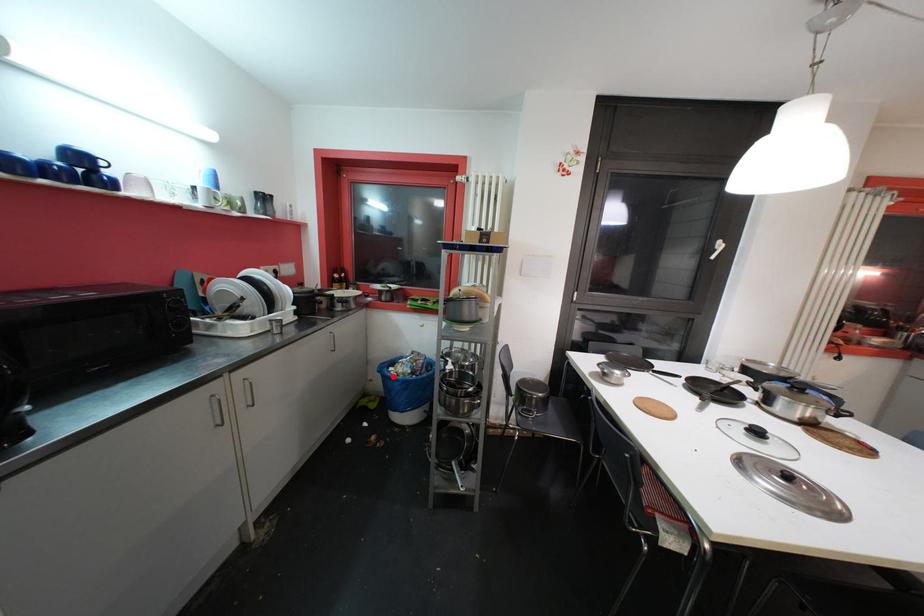
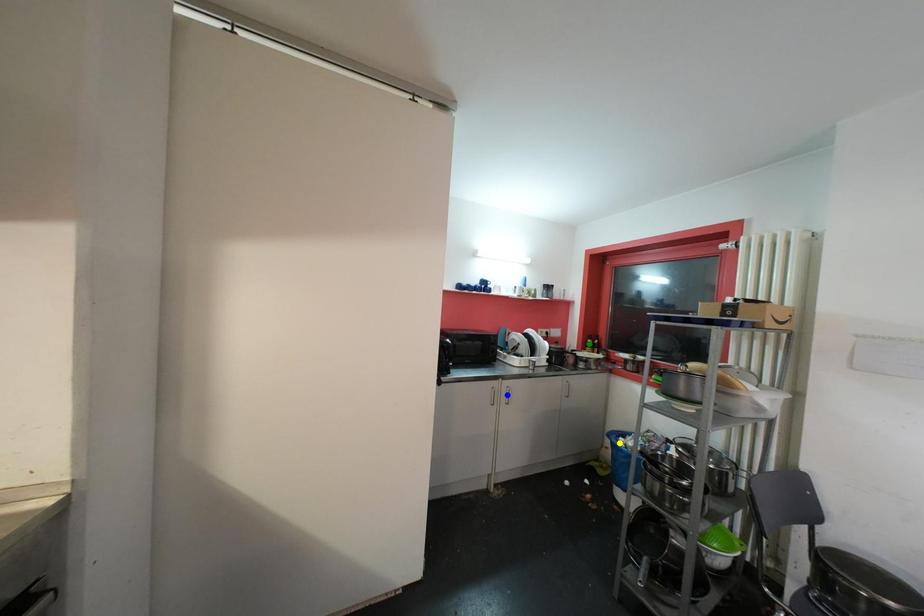
Question: I am providing you with two images of the same scene from different viewpoints. A red point is marked on the first image. You are given multiple points on the second image. Which spot in image 2 lines up with the point in image 1?

Choices:
 (A) yellow point
 (B) green point
 (C) blue point

Answer: (A)